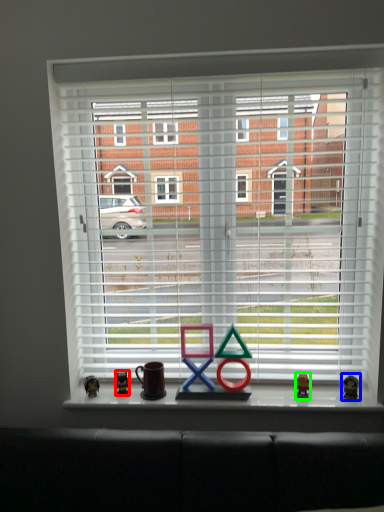
Question: Considering the real-world distances, which object is closest to miniature (highlighted by a red box)? miniature (highlighted by a blue box) or miniature (highlighted by a green box).

Choices:
 (A) miniature
 (B) miniature

Answer: (B)